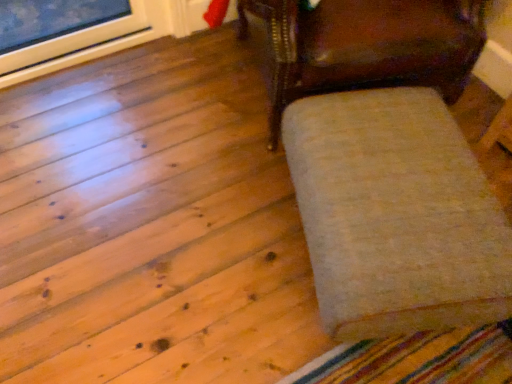
Question: From the image's perspective, is shiny dark wood chair at center below white fluffy ottoman at right?

Choices:
 (A) no
 (B) yes

Answer: (A)

Question: Does shiny dark wood chair at center have a lesser width compared to white fluffy ottoman at right?

Choices:
 (A) yes
 (B) no

Answer: (B)

Question: Is shiny dark wood chair at center at the left side of white fluffy ottoman at right?

Choices:
 (A) yes
 (B) no

Answer: (A)

Question: Can you confirm if shiny dark wood chair at center is shorter than white fluffy ottoman at right?

Choices:
 (A) yes
 (B) no

Answer: (B)

Question: Would you say shiny dark wood chair at center is outside white fluffy ottoman at right?

Choices:
 (A) no
 (B) yes

Answer: (B)

Question: Is shiny dark wood chair at center positioned with its back to white fluffy ottoman at right?

Choices:
 (A) yes
 (B) no

Answer: (B)

Question: Does white fluffy ottoman at right have a larger size compared to shiny dark wood chair at center?

Choices:
 (A) yes
 (B) no

Answer: (B)

Question: Considering the relative positions of white fluffy ottoman at right and shiny dark wood chair at center in the image provided, is white fluffy ottoman at right to the right of shiny dark wood chair at center from the viewer's perspective?

Choices:
 (A) yes
 (B) no

Answer: (A)

Question: Is white fluffy ottoman at right in contact with shiny dark wood chair at center?

Choices:
 (A) yes
 (B) no

Answer: (B)

Question: From the image's perspective, does white fluffy ottoman at right appear higher than shiny dark wood chair at center?

Choices:
 (A) no
 (B) yes

Answer: (A)

Question: Would you say white fluffy ottoman at right is a long distance from shiny dark wood chair at center?

Choices:
 (A) yes
 (B) no

Answer: (B)

Question: Does white fluffy ottoman at right have a lesser width compared to shiny dark wood chair at center?

Choices:
 (A) yes
 (B) no

Answer: (A)

Question: Is white fluffy ottoman at right taller or shorter than shiny dark wood chair at center?

Choices:
 (A) short
 (B) tall

Answer: (A)